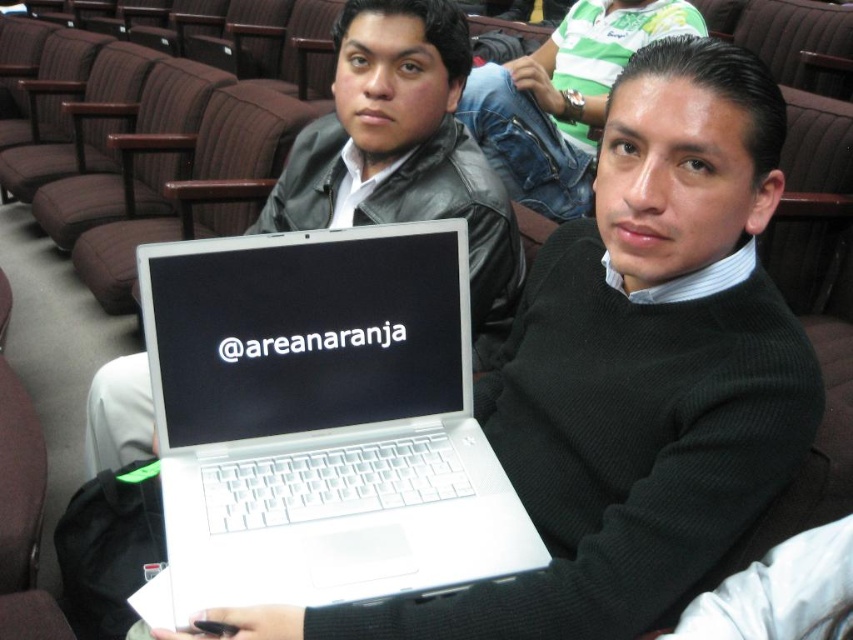
You are organizing a tech fair and need to place two laptops on a 12 inch wide table. The laptops are the white plastic laptop at center and the white matte laptop at center. Can both fit side by side on the table?

The white plastic laptop at center is narrower than the white matte laptop at center. However, without knowing the exact widths of both laptops, it is impossible to determine if their combined width is less than or equal to 12 inches. Additional measurements are needed to confirm.

You are standing at the entrance of the auditorium and see two points marked in the scene. Which point is closer to you, point (422, 236) or point (361, 170)?

Point (422, 236) is in front of point (361, 170), so it is closer to you.

You are standing in the auditorium and want to place a new laptop exactly where the white plastic laptop at center is currently located. What are the coordinates you should aim for?

A: You should aim for the coordinates point (322, 419) where the white plastic laptop at center is located.